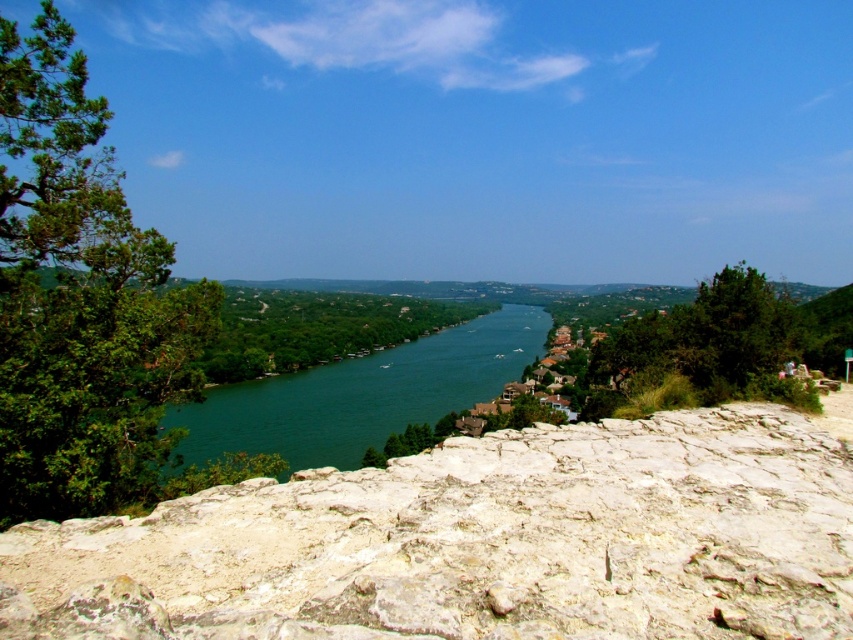
Does white rocky cliff at center have a greater height compared to green smooth water at center?

No.

Is white rocky cliff at center below green smooth water at center?

Incorrect, white rocky cliff at center is not positioned below green smooth water at center.

You are a GUI agent. You are given a task and a screenshot of the screen. Output one action in this format:
    pyautogui.click(x=<x>, y=<y>)
    Task: Click on the white rocky cliff at center
    This screenshot has width=853, height=640.
    Given the screenshot: What is the action you would take?
    pyautogui.click(x=477, y=541)